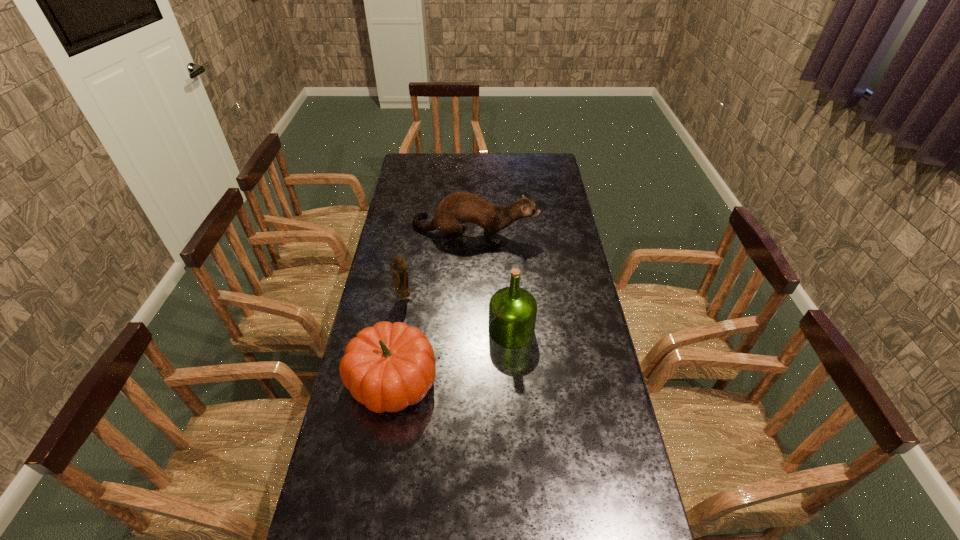
Image resolution: width=960 pixels, height=540 pixels. Identify the location of the tallest object. (512, 310).

I want to click on the third nearest object, so click(x=398, y=266).

The image size is (960, 540). I want to click on ferret, so click(457, 208).

Locate an element on the screen. pumpkin is located at coordinates (387, 367).

At what (x,y) coordinates should I click in order to perform the action: click on vacant space located on the right of the olive oil. Please return your answer as a coordinate pair (x, y). Looking at the image, I should click on (595, 330).

I want to click on vacant space located on the front-facing side of the third nearest object, so click(400, 321).

At what (x,y) coordinates should I click in order to perform the action: click on vacant space situated at the face of the farthest object. Please return your answer as a coordinate pair (x, y). Looking at the image, I should click on (561, 230).

What are the coordinates of `free space located on the right of the pumpkin` in the screenshot? It's located at coord(498,381).

Where is `figurine that is at the left edge`? figurine that is at the left edge is located at coordinates (398, 266).

Identify the location of ferret at the left edge. The width and height of the screenshot is (960, 540). (457, 208).